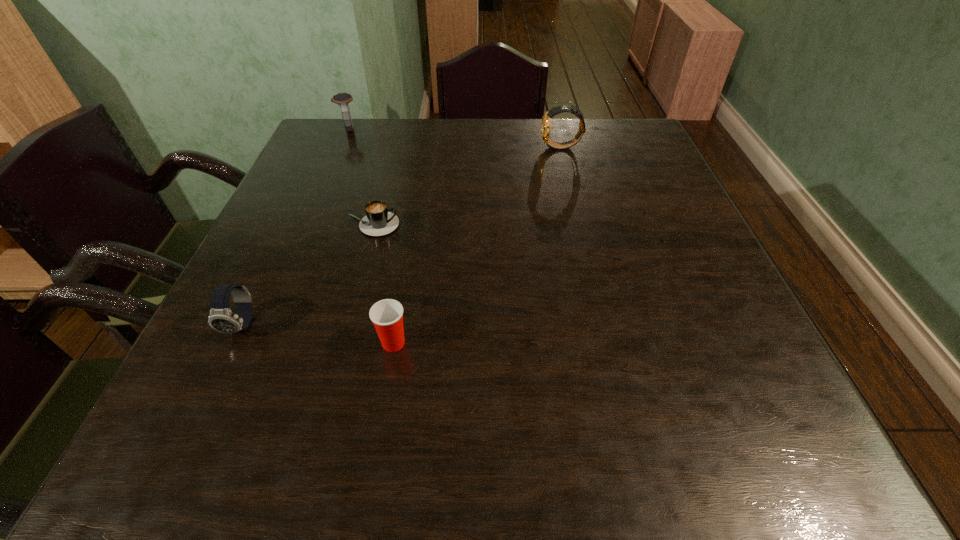
Image resolution: width=960 pixels, height=540 pixels. Identify the location of the rightmost object. (546, 119).

This screenshot has height=540, width=960. Find the location of `the tallest watch`. the tallest watch is located at coordinates (546, 119).

At what (x,y) coordinates should I click in order to perform the action: click on the farthest object. Please return your answer as a coordinate pair (x, y). The height and width of the screenshot is (540, 960). Looking at the image, I should click on (342, 99).

The height and width of the screenshot is (540, 960). In order to click on the nearest watch in this screenshot , I will do `click(221, 318)`.

At what (x,y) coordinates should I click in order to perform the action: click on the second object from right to left. Please return your answer as a coordinate pair (x, y). Looking at the image, I should click on (387, 315).

I want to click on cappuccino, so click(378, 221).

I want to click on the third object from left to right, so click(x=378, y=221).

This screenshot has width=960, height=540. What are the coordinates of `free space located 0.070m on the face of the second farthest object` in the screenshot? It's located at (516, 147).

Where is `free space located on the face of the second farthest object`? free space located on the face of the second farthest object is located at coordinates (512, 147).

You are a GUI agent. You are given a task and a screenshot of the screen. Output one action in this format:
    pyautogui.click(x=<x>, y=<y>)
    Task: Click on the free spot located 0.370m on the face of the second farthest object
    
    Given the screenshot: What is the action you would take?
    pyautogui.click(x=406, y=147)